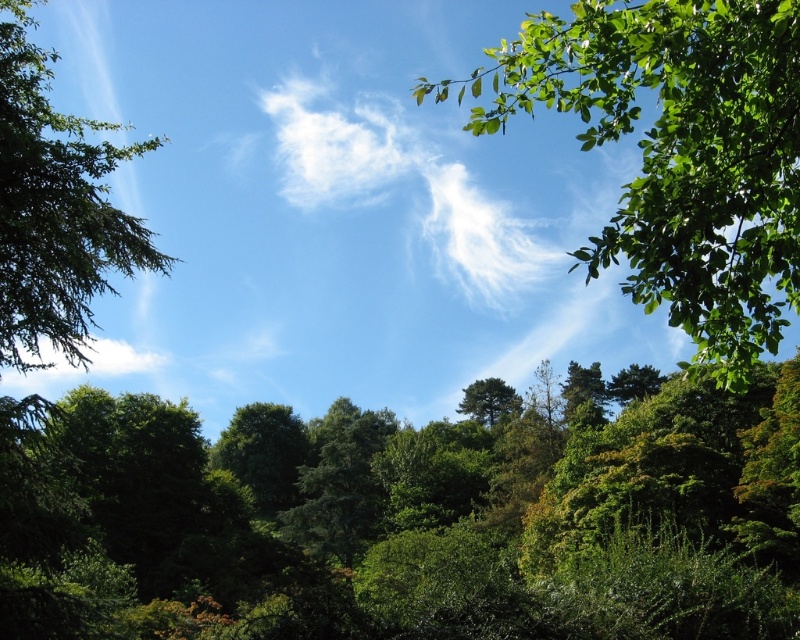
Is green leafy forest at center smaller than white cotton cloud at upper center?

A: Actually, green leafy forest at center might be larger than white cotton cloud at upper center.

Does green leafy forest at center appear on the right side of white cotton cloud at upper center?

Correct, you'll find green leafy forest at center to the right of white cotton cloud at upper center.

Does point (325, 448) come farther from viewer compared to point (529, 264)?

No, (325, 448) is closer to viewer.

I want to click on green leafy forest at center, so click(x=412, y=516).

Does white cotton cloud at upper center have a lesser height compared to green matte tree at center?

In fact, white cotton cloud at upper center may be taller than green matte tree at center.

Is point (438, 260) closer to viewer compared to point (464, 394)?

No, (438, 260) is further to viewer.

Locate an element on the screen. The height and width of the screenshot is (640, 800). white cotton cloud at upper center is located at coordinates (400, 184).

Based on the photo, can you confirm if green leafy branch at upper right is positioned to the left of green matte tree at center?

Incorrect, green leafy branch at upper right is not on the left side of green matte tree at center.

Which is below, green leafy branch at upper right or green matte tree at center?

green matte tree at center is lower down.

Does point (705, 3) come closer to viewer compared to point (513, 403)?

That is True.

Image resolution: width=800 pixels, height=640 pixels. What are the coordinates of `green leafy branch at upper right` in the screenshot? It's located at (678, 154).